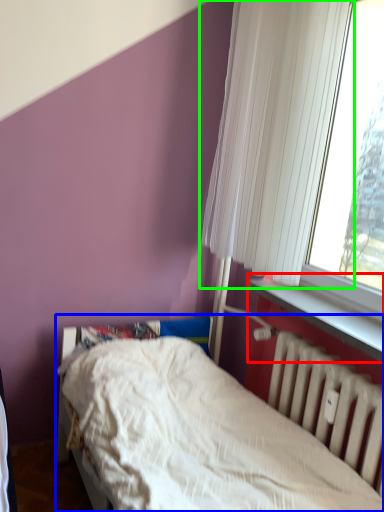
Question: Considering the real-world distances, which object is farthest from window sill (highlighted by a red box)? bed (highlighted by a blue box) or curtain (highlighted by a green box)?

Choices:
 (A) bed
 (B) curtain

Answer: (B)